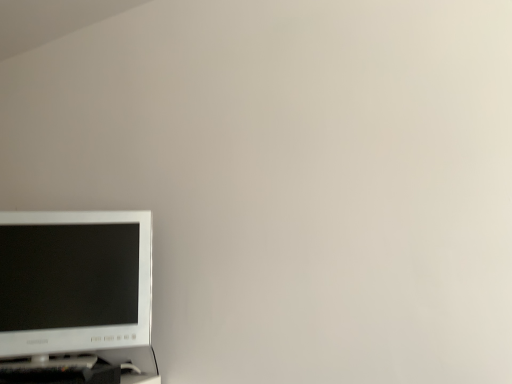
Question: Is black plastic computer desk at lower left in front of or behind white glossy computer monitor at lower left in the image?

Choices:
 (A) front
 (B) behind

Answer: (A)

Question: Considering the positions of black plastic computer desk at lower left and white glossy computer monitor at lower left in the image, is black plastic computer desk at lower left wider or thinner than white glossy computer monitor at lower left?

Choices:
 (A) wide
 (B) thin

Answer: (A)

Question: Looking at the image, does black plastic computer desk at lower left seem bigger or smaller compared to white glossy computer monitor at lower left?

Choices:
 (A) big
 (B) small

Answer: (B)

Question: In terms of width, does white glossy computer monitor at lower left look wider or thinner when compared to black plastic computer desk at lower left?

Choices:
 (A) thin
 (B) wide

Answer: (A)

Question: Is white glossy computer monitor at lower left inside or outside of black plastic computer desk at lower left?

Choices:
 (A) outside
 (B) inside

Answer: (A)

Question: From the image's perspective, is white glossy computer monitor at lower left located above or below black plastic computer desk at lower left?

Choices:
 (A) below
 (B) above

Answer: (B)

Question: Considering their positions, is white glossy computer monitor at lower left located in front of or behind black plastic computer desk at lower left?

Choices:
 (A) behind
 (B) front

Answer: (A)